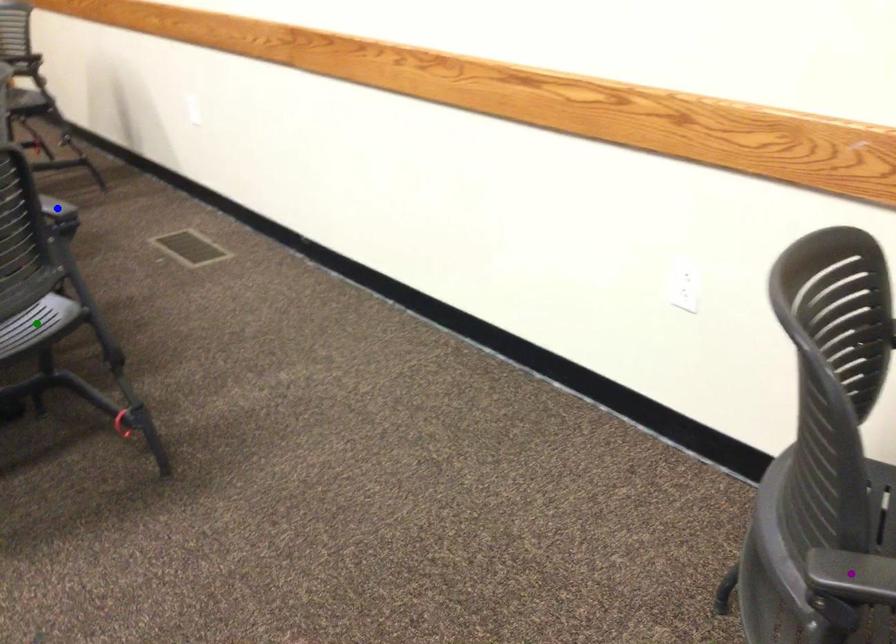
Order these from nearest to farthest:
- purple point
- blue point
- green point

green point → blue point → purple point